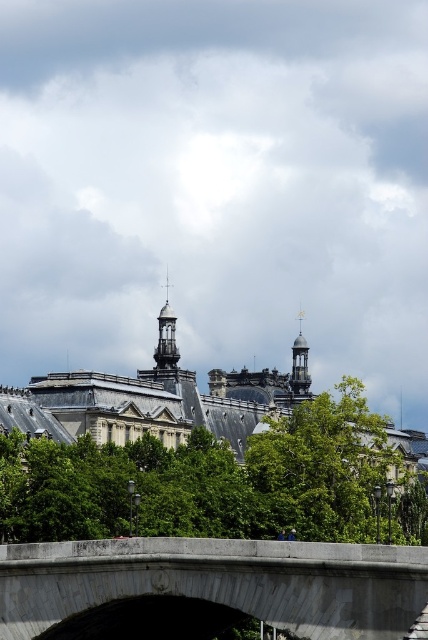
Question: Based on their relative distances, which object is nearer to the polished brass clock tower at center?

Choices:
 (A) gray concrete bridge at center
 (B) green leafy tree at center

Answer: (B)

Question: Does green leafy tree at center have a smaller size compared to gray concrete bridge at center?

Choices:
 (A) no
 (B) yes

Answer: (A)

Question: Observing the image, what is the correct spatial positioning of green leafy tree at center in reference to gold metallic clock tower at upper right?

Choices:
 (A) above
 (B) below

Answer: (B)

Question: Which of the following is the closest to the observer?

Choices:
 (A) (383, 445)
 (B) (300, 384)
 (C) (294, 625)

Answer: (C)

Question: Which object is positioned closest to the green leafy tree at center?

Choices:
 (A) polished brass clock tower at center
 (B) gold metallic clock tower at upper right

Answer: (A)

Question: Does green leafy tree at center appear over gray concrete bridge at center?

Choices:
 (A) yes
 (B) no

Answer: (A)